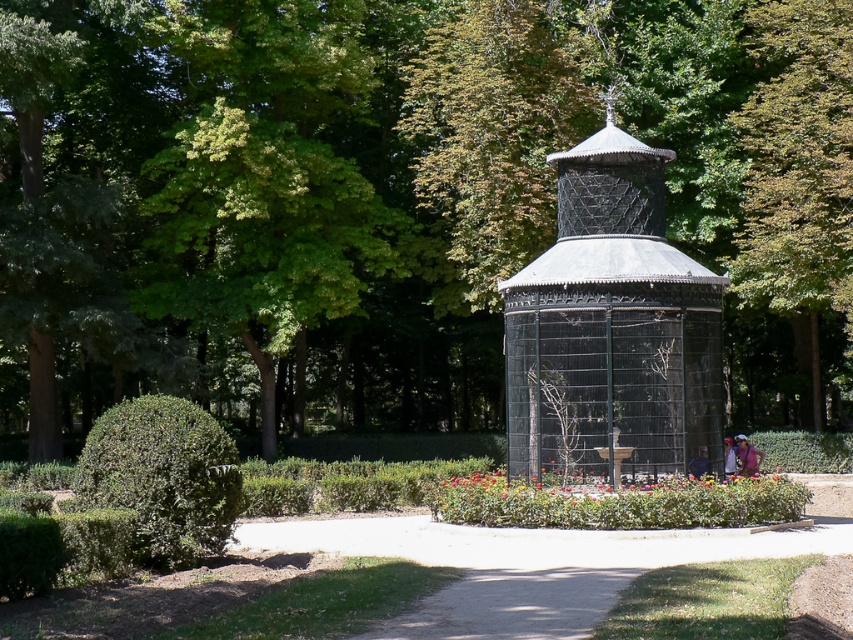
Question: Which object is positioned closest to the green leafy hedge at lower left?

Choices:
 (A) black metal gazebo at center
 (B) green leafy tree at center

Answer: (A)

Question: From the image, what is the correct spatial relationship of black metal gazebo at center in relation to green leafy hedge at lower left?

Choices:
 (A) below
 (B) above

Answer: (B)

Question: In this image, where is green leafy tree at center located relative to green leafy hedge at lower left?

Choices:
 (A) right
 (B) left

Answer: (A)

Question: Is black metal gazebo at center to the left of black metal cage at center from the viewer's perspective?

Choices:
 (A) yes
 (B) no

Answer: (B)

Question: Estimate the real-world distances between objects in this image. Which object is farther from the green leafy hedge at lower left?

Choices:
 (A) green leafy tree at center
 (B) black metal cage at center

Answer: (A)

Question: Which of the following is the farthest from the observer?

Choices:
 (A) (572, 280)
 (B) (225, 529)
 (C) (653, 408)

Answer: (C)